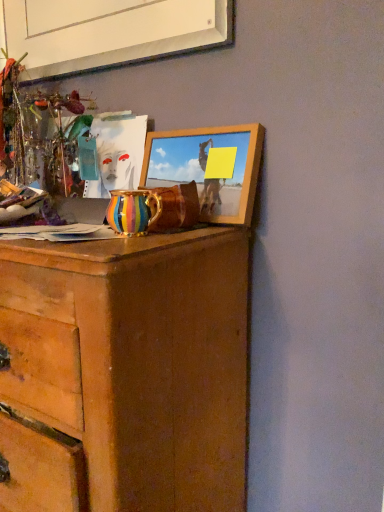
Question: From their relative heights in the image, would you say wooden chest of drawers at center is taller or shorter than multicolored ceramic vase at center?

Choices:
 (A) tall
 (B) short

Answer: (A)

Question: From a real-world perspective, is wooden chest of drawers at center above or below multicolored ceramic vase at center?

Choices:
 (A) below
 (B) above

Answer: (A)

Question: Based on their relative distances, which object is nearer to the white matte picture frame at upper center, which is counted as the second picture frame, starting from the bottom?

Choices:
 (A) wooden chest of drawers at center
 (B) multicolored ceramic vase at center
 (C) wooden picture frame at upper center, arranged as the 1th picture frame when ordered from the bottom

Answer: (C)

Question: Which is nearer to the wooden chest of drawers at center?

Choices:
 (A) multicolored ceramic vase at center
 (B) white matte picture frame at upper center, the 1th picture frame from the top
 (C) wooden picture frame at upper center, arranged as the 1th picture frame when ordered from the bottom

Answer: (A)